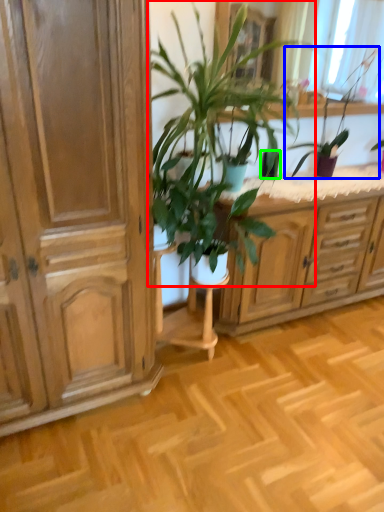
Question: Which is farther away from houseplant (highlighted by a red box)? houseplant (highlighted by a blue box) or flowerpot (highlighted by a green box)?

Choices:
 (A) houseplant
 (B) flowerpot

Answer: (A)